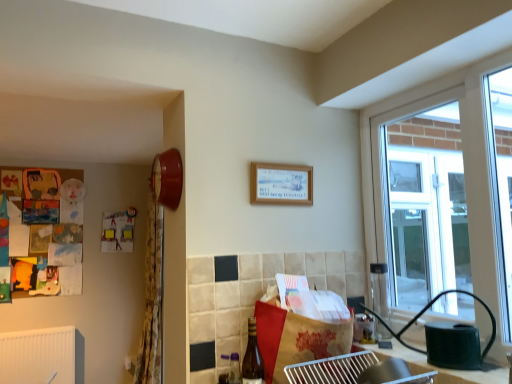
Question: Does brown paper bag at center have a greater height compared to wooden picture frame at upper center?

Choices:
 (A) no
 (B) yes

Answer: (B)

Question: Is there a large distance between brown paper bag at center and wooden picture frame at upper center?

Choices:
 (A) no
 (B) yes

Answer: (A)

Question: From the image's perspective, is brown paper bag at center below wooden picture frame at upper center?

Choices:
 (A) yes
 (B) no

Answer: (A)

Question: Is brown paper bag at center further to the viewer compared to wooden picture frame at upper center?

Choices:
 (A) yes
 (B) no

Answer: (B)

Question: Is brown paper bag at center not inside wooden picture frame at upper center?

Choices:
 (A) no
 (B) yes

Answer: (B)

Question: Is brown paper bag at center wider than wooden picture frame at upper center?

Choices:
 (A) yes
 (B) no

Answer: (A)

Question: Considering the relative sizes of wooden picture frame at upper center and brown glass bottle at lower center in the image provided, is wooden picture frame at upper center wider than brown glass bottle at lower center?

Choices:
 (A) no
 (B) yes

Answer: (A)

Question: From the image's perspective, is wooden picture frame at upper center under brown glass bottle at lower center?

Choices:
 (A) yes
 (B) no

Answer: (B)

Question: Does wooden picture frame at upper center come behind brown glass bottle at lower center?

Choices:
 (A) no
 (B) yes

Answer: (B)

Question: Considering the relative positions of wooden picture frame at upper center and brown glass bottle at lower center in the image provided, is wooden picture frame at upper center to the left of brown glass bottle at lower center from the viewer's perspective?

Choices:
 (A) yes
 (B) no

Answer: (B)

Question: From a real-world perspective, does wooden picture frame at upper center sit lower than brown glass bottle at lower center?

Choices:
 (A) no
 (B) yes

Answer: (A)

Question: Is wooden picture frame at upper center oriented towards brown glass bottle at lower center?

Choices:
 (A) yes
 (B) no

Answer: (B)

Question: Does matte red clock at upper left have a lesser height compared to wooden picture frame at upper center?

Choices:
 (A) no
 (B) yes

Answer: (A)